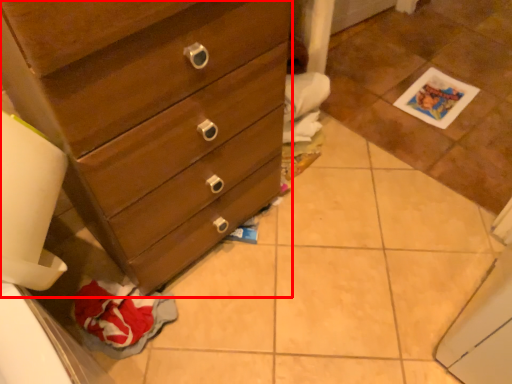
Question: From the image's perspective, what is the correct spatial relationship of chest of drawers (annotated by the red box) in relation to tile?

Choices:
 (A) below
 (B) above

Answer: (A)